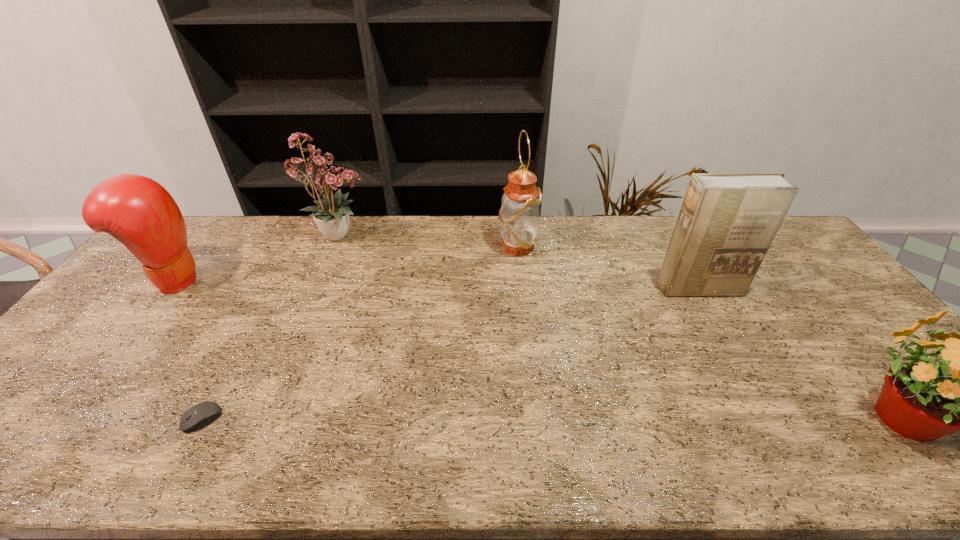
Locate an element on the screen. oil lamp located in the far edge section of the desktop is located at coordinates (519, 215).

The width and height of the screenshot is (960, 540). I want to click on flower arrangement located at the far edge, so click(x=332, y=215).

Locate an element on the screen. The width and height of the screenshot is (960, 540). object situated at the near edge is located at coordinates (200, 415).

Identify the location of object located in the left edge section of the desktop. This screenshot has height=540, width=960. tap(137, 211).

The height and width of the screenshot is (540, 960). I want to click on vacant space at the far edge, so click(628, 245).

In the image, there is a desktop. What are the coordinates of `vacant space at the near edge` in the screenshot? It's located at (824, 440).

Locate an element on the screen. vacant space at the left edge of the desktop is located at coordinates (47, 404).

Where is `vacant space at the right edge`? This screenshot has width=960, height=540. vacant space at the right edge is located at coordinates (799, 286).

Image resolution: width=960 pixels, height=540 pixels. Find the location of `vacant point located between the oil lamp and the flower arrangement`. vacant point located between the oil lamp and the flower arrangement is located at coordinates (429, 241).

This screenshot has width=960, height=540. Find the location of `free space between the computer equipment and the boxing glove`. free space between the computer equipment and the boxing glove is located at coordinates (188, 349).